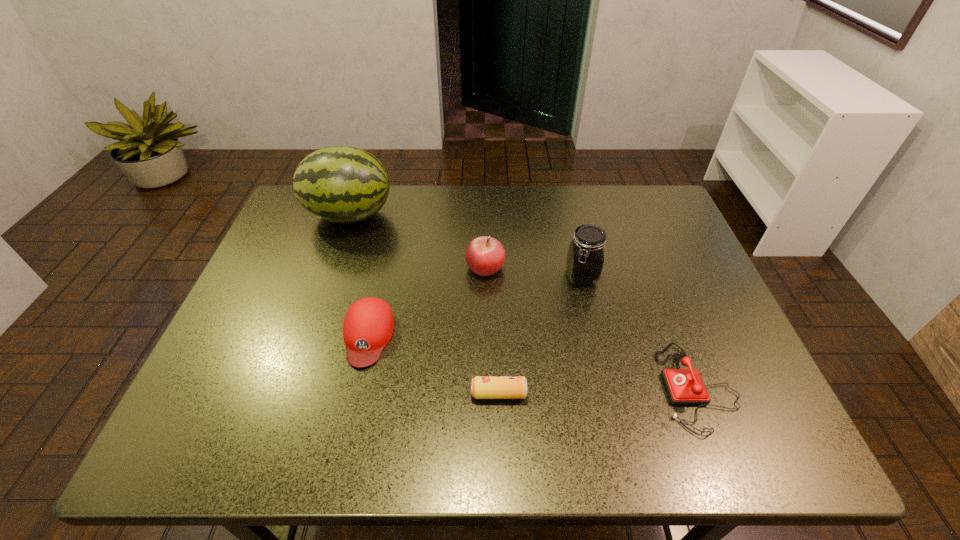
In order to click on the tallest object in this screenshot , I will do `click(341, 184)`.

The width and height of the screenshot is (960, 540). What are the coordinates of `watermelon` in the screenshot? It's located at (341, 184).

At what (x,y) coordinates should I click in order to perform the action: click on the second object from right to left. Please return your answer as a coordinate pair (x, y). Looking at the image, I should click on [x=585, y=259].

Locate an element on the screen. This screenshot has height=540, width=960. the second tallest object is located at coordinates (585, 259).

At what (x,y) coordinates should I click in order to perform the action: click on the fourth shortest object. Please return your answer as a coordinate pair (x, y). The width and height of the screenshot is (960, 540). Looking at the image, I should click on (485, 256).

At what (x,y) coordinates should I click in order to perform the action: click on the third shortest object. Please return your answer as a coordinate pair (x, y). Looking at the image, I should click on (368, 326).

You are a GUI agent. You are given a task and a screenshot of the screen. Output one action in this format:
    pyautogui.click(x=<x>, y=<y>)
    Task: Click on the second shortest object
    The width and height of the screenshot is (960, 540).
    Given the screenshot: What is the action you would take?
    pyautogui.click(x=684, y=386)

This screenshot has width=960, height=540. I want to click on telephone, so click(684, 386).

Locate an element on the screen. beer can is located at coordinates (482, 387).

This screenshot has height=540, width=960. Identify the location of vacant space located 0.250m at the stem end of the farthest object. (476, 215).